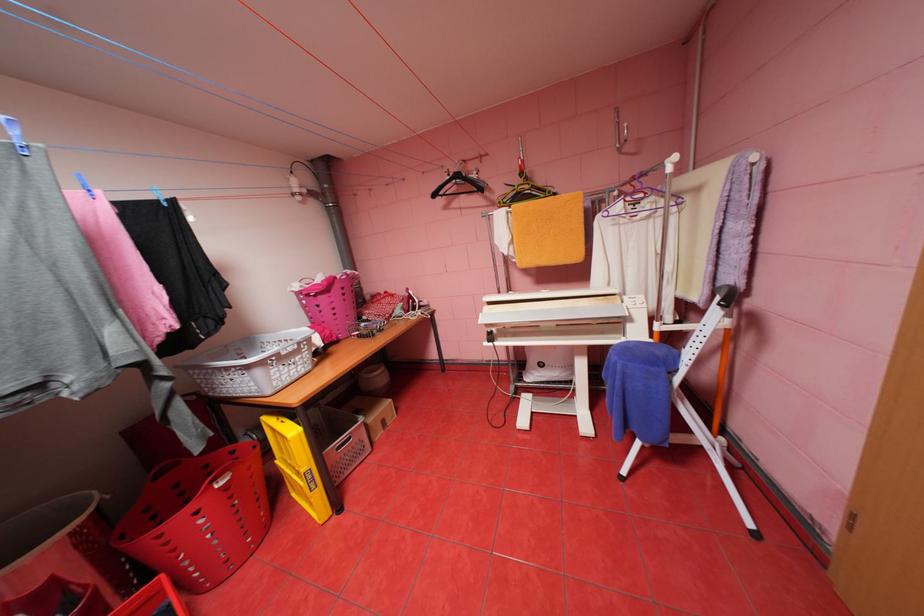
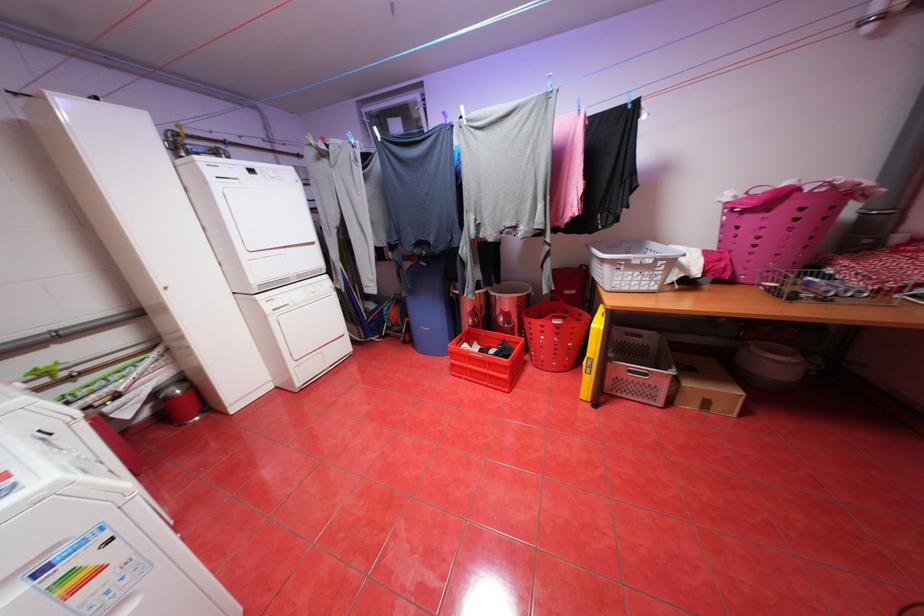
The point at (351,477) is marked in the first image. Where is the corresponding point in the second image?

(627, 394)